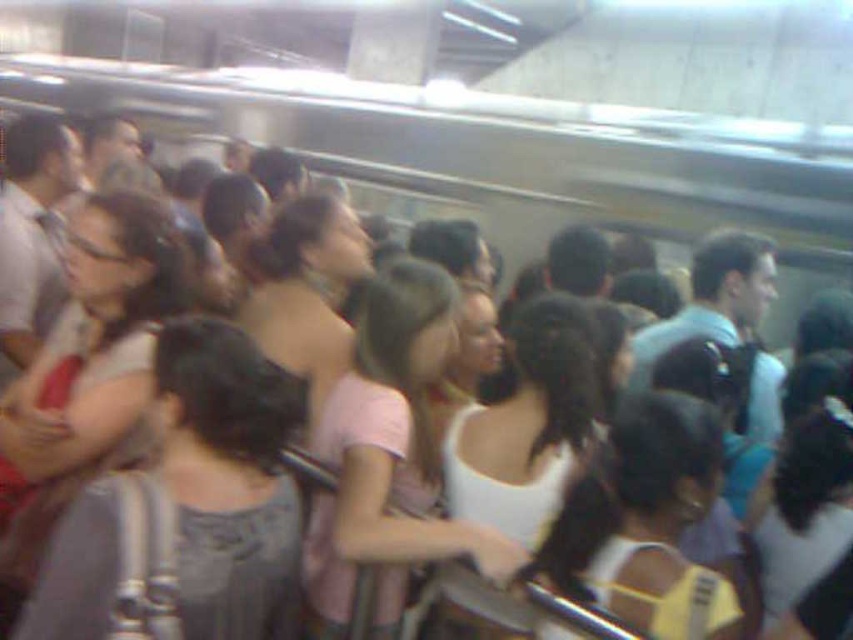
Question: Based on their relative distances, which object is farther from the gray matte shirt at center?

Choices:
 (A) white matte backpack at center
 (B) white matte tank top at center
 (C) white matte shirt at center
 (D) pink fabric at center

Answer: (C)

Question: Is gray matte shirt at center behind white matte backpack at center?

Choices:
 (A) yes
 (B) no

Answer: (B)

Question: Can you confirm if pink fabric at center is positioned to the right of white matte backpack at center?

Choices:
 (A) no
 (B) yes

Answer: (A)

Question: Among these objects, which one is nearest to the camera?

Choices:
 (A) white matte backpack at center
 (B) matte black glasses at left
 (C) gray matte shirt at center
 (D) pink fabric at center

Answer: (C)

Question: Can you confirm if matte black glasses at left is wider than white matte shirt at center?

Choices:
 (A) yes
 (B) no

Answer: (B)

Question: Which object is positioned closest to the white matte shirt at center?

Choices:
 (A) matte black glasses at left
 (B) gray matte shirt at center
 (C) pink fabric at center
 (D) white matte backpack at center

Answer: (D)